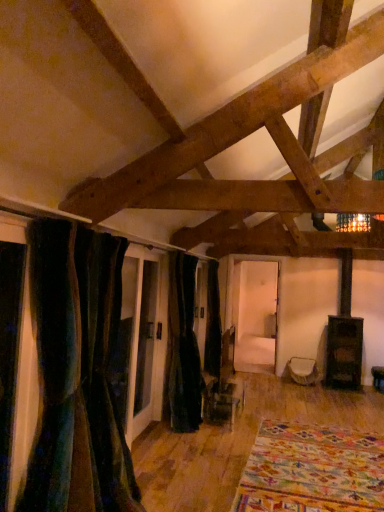
Describe the element at coordinates (183, 347) in the screenshot. The width and height of the screenshot is (384, 512). I see `velvet dark green curtain at center, which is counted as the first curtain, starting from the back` at that location.

Describe the element at coordinates (312, 470) in the screenshot. The image size is (384, 512). I see `multicolored woven rug at lower right` at that location.

Identify the location of white fabric ottoman at center. (303, 371).

This screenshot has width=384, height=512. I want to click on velvet dark green curtain at center, the 2th curtain in the front-to-back sequence, so click(183, 347).

Which object is thinner, multicolored woven rug at lower right or velvet dark green curtain at center, the 2th curtain in the front-to-back sequence?

With smaller width is velvet dark green curtain at center, the 2th curtain in the front-to-back sequence.

Does multicolored woven rug at lower right turn towards velvet dark green curtain at center, the 2th curtain in the front-to-back sequence?

A: No, multicolored woven rug at lower right is not facing towards velvet dark green curtain at center, the 2th curtain in the front-to-back sequence.

From the image's perspective, relative to velvet dark green curtain at center, the 2th curtain in the front-to-back sequence, is multicolored woven rug at lower right above or below?

multicolored woven rug at lower right is below velvet dark green curtain at center, the 2th curtain in the front-to-back sequence.

Could you tell me if multicolored woven rug at lower right is facing velvet dark green curtain at left, which is counted as the first curtain, starting from the front?

No, multicolored woven rug at lower right does not turn towards velvet dark green curtain at left, which is counted as the first curtain, starting from the front.

Between multicolored woven rug at lower right and velvet dark green curtain at left, which appears as the second curtain when viewed from the back, which one has more height?

With more height is velvet dark green curtain at left, which appears as the second curtain when viewed from the back.

Could you measure the distance between multicolored woven rug at lower right and velvet dark green curtain at left, which is counted as the first curtain, starting from the front?

multicolored woven rug at lower right is 5.77 feet from velvet dark green curtain at left, which is counted as the first curtain, starting from the front.

Considering their positions, is multicolored woven rug at lower right located in front of or behind velvet dark green curtain at left, which is counted as the first curtain, starting from the front?

In the image, multicolored woven rug at lower right appears behind velvet dark green curtain at left, which is counted as the first curtain, starting from the front.

Can you confirm if velvet dark green curtain at center, the 2th curtain in the front-to-back sequence, is positioned to the left of velvet dark green curtain at left, which appears as the second curtain when viewed from the back?

No, velvet dark green curtain at center, the 2th curtain in the front-to-back sequence, is not to the left of velvet dark green curtain at left, which appears as the second curtain when viewed from the back.

Looking at the image, does velvet dark green curtain at center, which is counted as the first curtain, starting from the back, seem bigger or smaller compared to velvet dark green curtain at left, which appears as the second curtain when viewed from the back?

Considering their sizes, velvet dark green curtain at center, which is counted as the first curtain, starting from the back, takes up less space than velvet dark green curtain at left, which appears as the second curtain when viewed from the back.

Is point (194, 410) closer to viewer compared to point (47, 341)?

No, (194, 410) is behind (47, 341).

Which of these two, velvet dark green curtain at center, the 2th curtain in the front-to-back sequence, or velvet dark green curtain at left, which is counted as the first curtain, starting from the front, is thinner?

With smaller width is velvet dark green curtain at center, the 2th curtain in the front-to-back sequence.

Could you measure the distance between white fabric ottoman at center and velvet dark green curtain at left, which appears as the second curtain when viewed from the back?

They are 4.66 meters apart.

Considering the relative sizes of white fabric ottoman at center and velvet dark green curtain at left, which is counted as the first curtain, starting from the front, in the image provided, is white fabric ottoman at center thinner than velvet dark green curtain at left, which is counted as the first curtain, starting from the front,?

Indeed, white fabric ottoman at center has a lesser width compared to velvet dark green curtain at left, which is counted as the first curtain, starting from the front.

Visually, is white fabric ottoman at center positioned to the left or to the right of velvet dark green curtain at left, which is counted as the first curtain, starting from the front?

white fabric ottoman at center is to the right of velvet dark green curtain at left, which is counted as the first curtain, starting from the front.

Is white fabric ottoman at center shorter than velvet dark green curtain at left, which is counted as the first curtain, starting from the front?

Indeed, white fabric ottoman at center has a lesser height compared to velvet dark green curtain at left, which is counted as the first curtain, starting from the front.

This screenshot has height=512, width=384. What are the coordinates of `blanket on the left of white fabric ottoman at center` in the screenshot? It's located at (312, 470).

Can you see white fabric ottoman at center touching multicolored woven rug at lower right?

No, white fabric ottoman at center is not touching multicolored woven rug at lower right.

Can you tell me how much white fabric ottoman at center and multicolored woven rug at lower right differ in facing direction?

2.58 degrees separate the facing orientations of white fabric ottoman at center and multicolored woven rug at lower right.

In terms of width, does white fabric ottoman at center look wider or thinner when compared to multicolored woven rug at lower right?

Considering their sizes, white fabric ottoman at center looks slimmer than multicolored woven rug at lower right.

Does point (272, 473) come in front of point (291, 357)?

Yes, it is.

Which of these two, multicolored woven rug at lower right or white fabric ottoman at center, is bigger?

multicolored woven rug at lower right.

Are multicolored woven rug at lower right and white fabric ottoman at center far apart?

Indeed, multicolored woven rug at lower right is not near white fabric ottoman at center.

Who is shorter, multicolored woven rug at lower right or white fabric ottoman at center?

multicolored woven rug at lower right.

This screenshot has height=512, width=384. What are the coordinates of `curtain below the velvet dark green curtain at left, which is counted as the first curtain, starting from the front (from a real-world perspective)` in the screenshot? It's located at (183, 347).

Is velvet dark green curtain at center, the 2th curtain in the front-to-back sequence, completely or partially inside velvet dark green curtain at left, which is counted as the first curtain, starting from the front?

That's incorrect, velvet dark green curtain at center, the 2th curtain in the front-to-back sequence, is not inside velvet dark green curtain at left, which is counted as the first curtain, starting from the front.

From a real-world perspective, which is physically above, velvet dark green curtain at left, which appears as the second curtain when viewed from the back, or velvet dark green curtain at center, the 2th curtain in the front-to-back sequence?

velvet dark green curtain at left, which appears as the second curtain when viewed from the back, from a real-world perspective.

Considering the sizes of objects velvet dark green curtain at left, which is counted as the first curtain, starting from the front, and velvet dark green curtain at center, which is counted as the first curtain, starting from the back, in the image provided, who is taller, velvet dark green curtain at left, which is counted as the first curtain, starting from the front, or velvet dark green curtain at center, which is counted as the first curtain, starting from the back,?

With more height is velvet dark green curtain at center, which is counted as the first curtain, starting from the back.

Locate an element on the screen. curtain that is the 1st object above the multicolored woven rug at lower right (from a real-world perspective) is located at coordinates (183, 347).

Where is `blanket on the right side of velvet dark green curtain at left, which is counted as the first curtain, starting from the front`? The width and height of the screenshot is (384, 512). blanket on the right side of velvet dark green curtain at left, which is counted as the first curtain, starting from the front is located at coordinates click(312, 470).

From the image, which object appears to be farther from white fabric ottoman at center, velvet dark green curtain at left, which appears as the second curtain when viewed from the back, or velvet dark green curtain at center, which is counted as the first curtain, starting from the back?

velvet dark green curtain at left, which appears as the second curtain when viewed from the back.

Estimate the real-world distances between objects in this image. Which object is further from velvet dark green curtain at left, which is counted as the first curtain, starting from the front, multicolored woven rug at lower right or white fabric ottoman at center?

white fabric ottoman at center is positioned further to the anchor velvet dark green curtain at left, which is counted as the first curtain, starting from the front.

Based on their spatial positions, is white fabric ottoman at center or velvet dark green curtain at center, which is counted as the first curtain, starting from the back, closer to multicolored woven rug at lower right?

velvet dark green curtain at center, which is counted as the first curtain, starting from the back, is closer to multicolored woven rug at lower right.

Looking at the image, which one is located further to multicolored woven rug at lower right, white fabric ottoman at center or velvet dark green curtain at left, which appears as the second curtain when viewed from the back?

white fabric ottoman at center lies further to multicolored woven rug at lower right than the other object.

Based on their spatial positions, is velvet dark green curtain at center, the 2th curtain in the front-to-back sequence, or multicolored woven rug at lower right closer to velvet dark green curtain at left, which appears as the second curtain when viewed from the back?

multicolored woven rug at lower right is closer to velvet dark green curtain at left, which appears as the second curtain when viewed from the back.

Which object lies nearer to the anchor point velvet dark green curtain at left, which appears as the second curtain when viewed from the back, white fabric ottoman at center or multicolored woven rug at lower right?

The object closer to velvet dark green curtain at left, which appears as the second curtain when viewed from the back, is multicolored woven rug at lower right.

Looking at the image, which one is located closer to white fabric ottoman at center, multicolored woven rug at lower right or velvet dark green curtain at left, which appears as the second curtain when viewed from the back?

multicolored woven rug at lower right is positioned closer to the anchor white fabric ottoman at center.

Which object lies further to the anchor point velvet dark green curtain at center, which is counted as the first curtain, starting from the back, white fabric ottoman at center or multicolored woven rug at lower right?

white fabric ottoman at center is positioned further to the anchor velvet dark green curtain at center, which is counted as the first curtain, starting from the back.

You are a GUI agent. You are given a task and a screenshot of the screen. Output one action in this format:
    pyautogui.click(x=<x>, y=<y>)
    Task: Click on the blanket between velvet dark green curtain at left, which appears as the second curtain when viewed from the back, and velvet dark green curtain at center, which is counted as the first curtain, starting from the back, in the front-back direction
    
    Given the screenshot: What is the action you would take?
    pyautogui.click(x=312, y=470)

The image size is (384, 512). In order to click on blanket between velvet dark green curtain at left, which appears as the second curtain when viewed from the back, and white fabric ottoman at center, along the z-axis in this screenshot , I will do `click(312, 470)`.

Where is `curtain between velvet dark green curtain at left, which appears as the second curtain when viewed from the back, and white fabric ottoman at center in the front-back direction`? The image size is (384, 512). curtain between velvet dark green curtain at left, which appears as the second curtain when viewed from the back, and white fabric ottoman at center in the front-back direction is located at coordinates (183, 347).

This screenshot has height=512, width=384. I want to click on curtain between multicolored woven rug at lower right and white fabric ottoman at center along the z-axis, so click(183, 347).